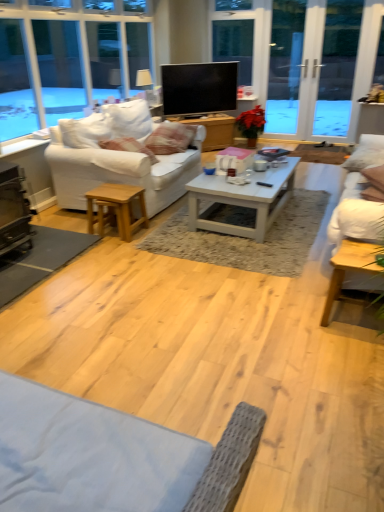
Question: In terms of height, does transparent glass screen door at upper right, acting as the second screen door starting from the right, look taller or shorter compared to white fabric couch at left, which is counted as the 1th studio couch, starting from the left?

Choices:
 (A) short
 (B) tall

Answer: (B)

Question: In terms of width, does transparent glass screen door at upper right, the 1th screen door from the left, look wider or thinner when compared to white fabric couch at left, which is counted as the 1th studio couch, starting from the left?

Choices:
 (A) wide
 (B) thin

Answer: (B)

Question: Estimate the real-world distances between objects in this image. Which object is farther from the transparent glass screen door at upper right, acting as the second screen door starting from the right?

Choices:
 (A) white painted wood coffee table at center, which is the first coffee table from top to bottom
 (B) light brown wood stool at lower left, arranged as the second table when viewed from the top
 (C) white fabric couch at left, which is counted as the 1th studio couch, starting from the left
 (D) white fabric pillow at right, which appears as the 2th pillow when viewed from the left
 (E) white fabric couch at right, which appears as the 2th studio couch when viewed from the left

Answer: (B)

Question: Based on their relative distances, which object is farther from the light brown wooden coffee table at center, the second coffee table from the top?

Choices:
 (A) white fabric couch at right, which is counted as the 1th studio couch, starting from the right
 (B) white painted wood coffee table at center, the 1th table viewed from the right
 (C) light brown wood stool at lower left, marked as the 2th table in a back-to-front arrangement
 (D) white fabric pillow at right, positioned as the 1th pillow in right-to-left order
 (E) black metal fireplace at lower left

Answer: (B)